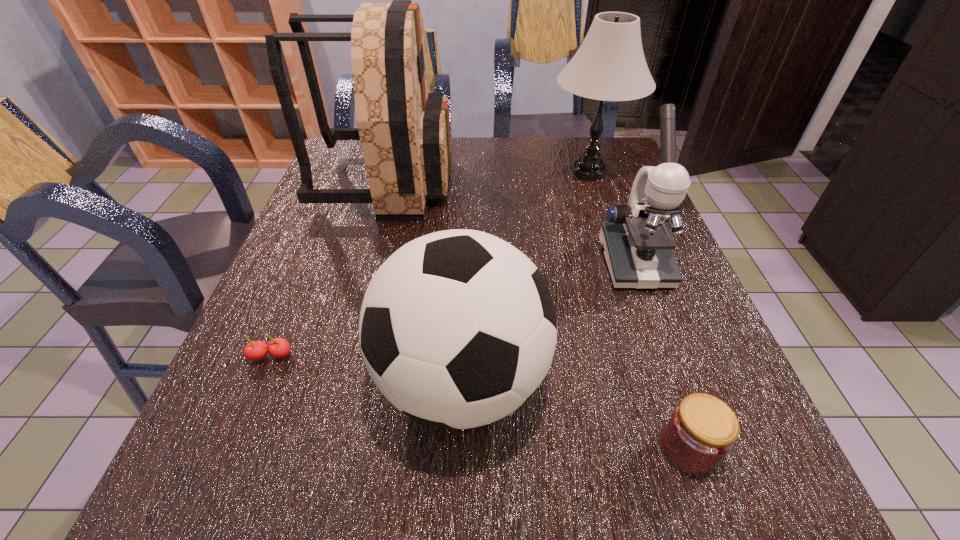
Image resolution: width=960 pixels, height=540 pixels. I want to click on free space that satisfies the following two spatial constraints: 1. on the front side of the lamp; 2. on the front face of the backpack, so click(x=592, y=183).